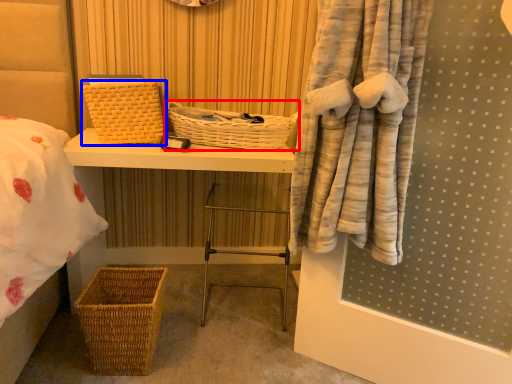
Question: Which of the following is the closest to the observer, basket (highlighted by a red box) or basket (highlighted by a blue box)?

Choices:
 (A) basket
 (B) basket

Answer: (B)